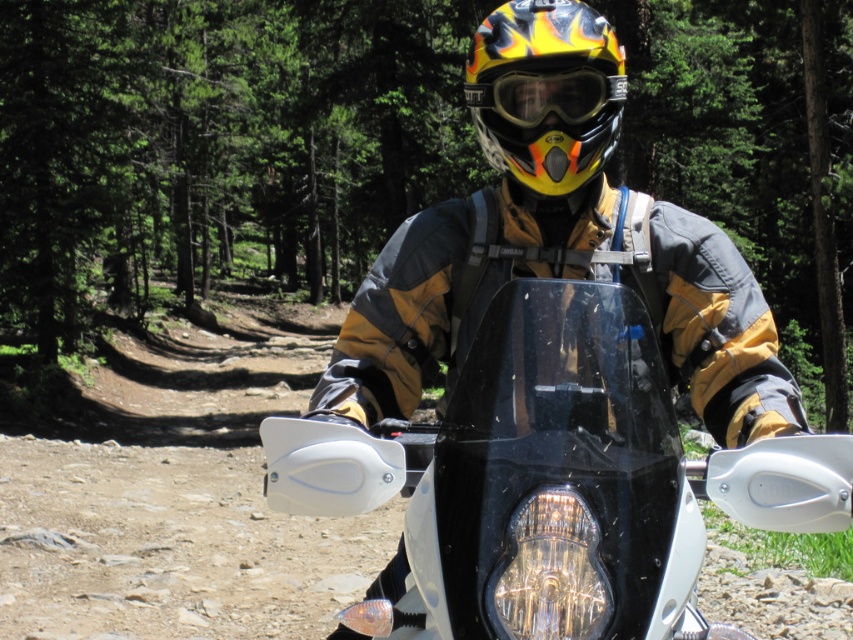
You are a hiker trying to navigate through the green leafy pine forest at upper center and the black plastic motorcycle at center. If you want to reach the forest first, which direction should you move relative to the motorcycle?

The green leafy pine forest at upper center is to the left of the black plastic motorcycle at center, so to reach the forest first, you should move to the left of the motorcycle.

You are a photographer trying to capture the flame pattern on the helmet of the motorcyclist. You notice that the helmet is at point (546,92). The motorcycle has white handlebars with white grips. Can you determine if the flame pattern on the helmet is visible from the front of the motorcycle?

The flame pattern on the helmet at point (546,92) is visible from the front of the motorcycle because the helmet is positioned at center, directly in front of the rider.

You are a photographer planning to take a wide shot of the green leafy pine forest at upper center and the black plastic motorcycle at center. Based on their sizes in the image, which object should you focus on first to ensure it appears larger in the photo?

The green leafy pine forest at upper center is bigger than the black plastic motorcycle at center, so you should focus on the green leafy pine forest at upper center first to ensure it appears larger in the photo.